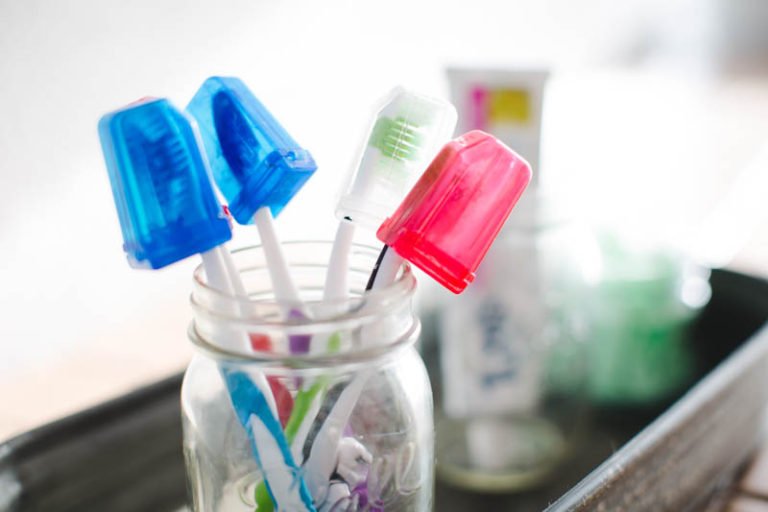
Where is `clear toothbrush cap`? The image size is (768, 512). clear toothbrush cap is located at coordinates (391, 159).